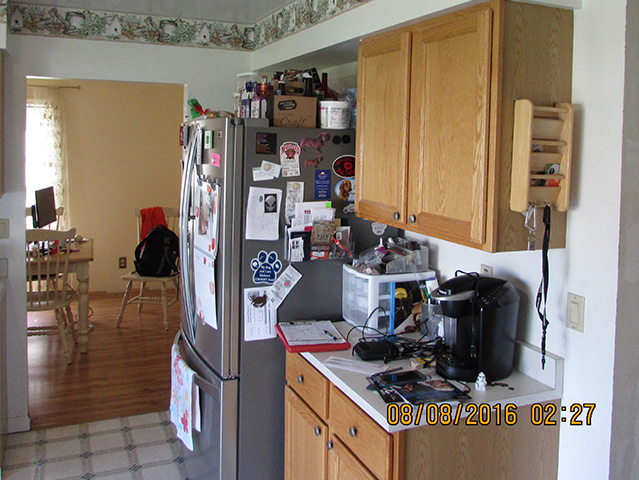
The height and width of the screenshot is (480, 639). Identify the location of fridge. (324, 278).